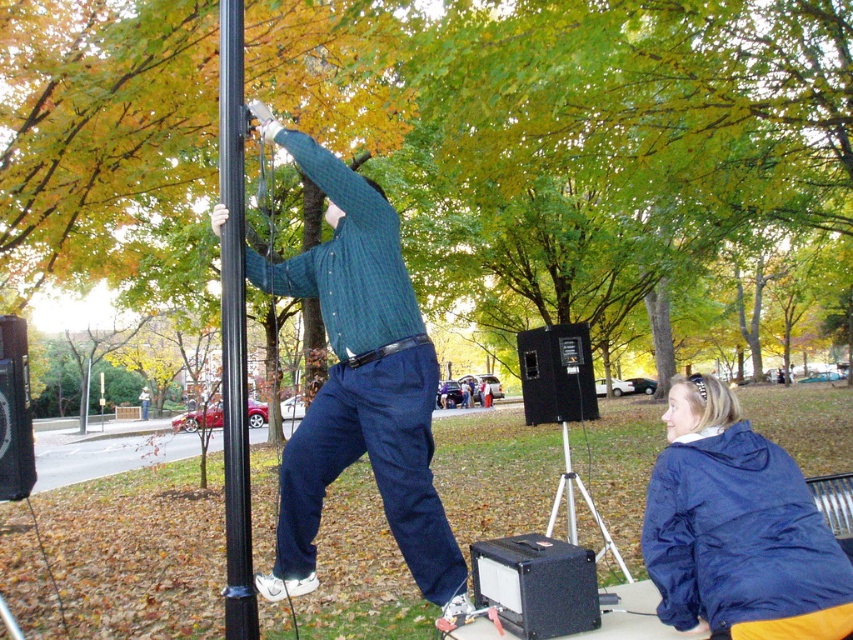
Question: Does green leafy tree at upper center have a smaller size compared to green knitted sweater at center?

Choices:
 (A) no
 (B) yes

Answer: (A)

Question: Does green knitted sweater at center have a lesser width compared to black matte tripod at lower center?

Choices:
 (A) no
 (B) yes

Answer: (A)

Question: Is green leafy tree at upper center further to camera compared to green knitted sweater at center?

Choices:
 (A) yes
 (B) no

Answer: (A)

Question: Which object is closer to the camera taking this photo?

Choices:
 (A) black metal pole at center
 (B) green leafy tree at upper center
 (C) green knitted sweater at center

Answer: (A)

Question: Considering the real-world distances, which object is closest to the black metal pole at center?

Choices:
 (A) matte blue jacket at lower right
 (B) black matte tripod at lower center

Answer: (A)

Question: Which object is the closest to the black matte tripod at lower center?

Choices:
 (A) green leafy tree at upper center
 (B) black metal pole at center

Answer: (B)